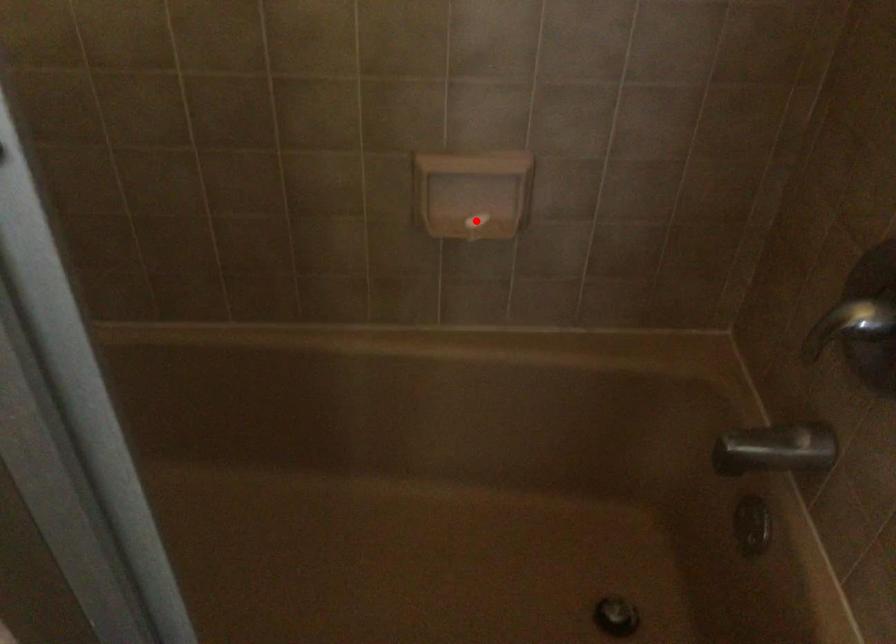
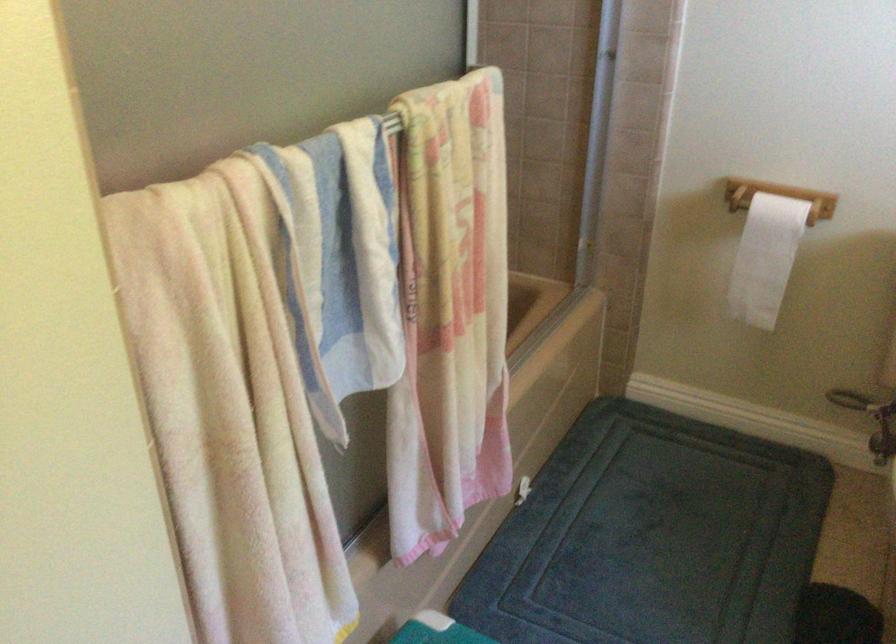
Question: I am providing you with two images of the same scene from different viewpoints. A red point is marked on the first image. Is the red point's position out of view in image 2?

Choices:
 (A) Yes
 (B) No

Answer: (A)